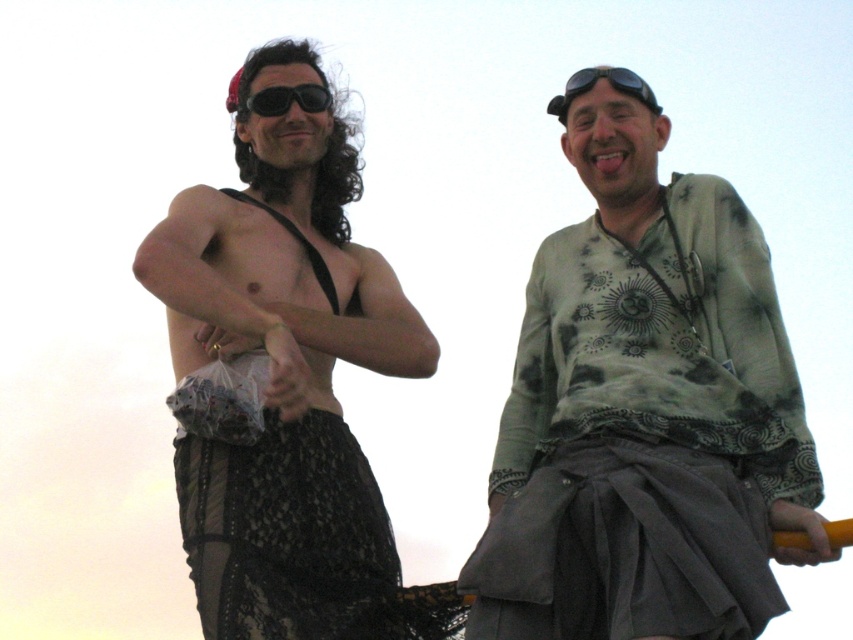
You are standing in the scene and want to place a small decorative item on the closest point between the two points marked as point (x=260, y=257) and point (x=566, y=83). Which point should you choose?

Point (x=260, y=257) is closer to the viewer than point (x=566, y=83), so you should place the item on point (x=260, y=257).